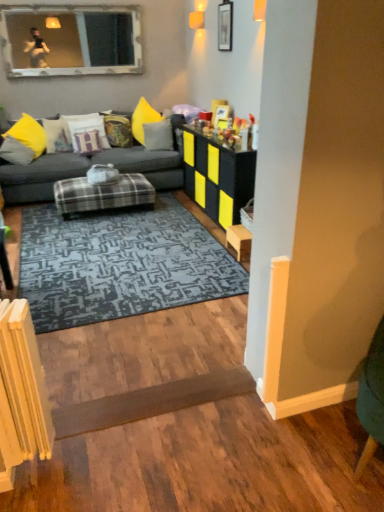
Where is `black textured cabinet at center, the 1th table in the right-to-left sequence`? black textured cabinet at center, the 1th table in the right-to-left sequence is located at coordinates (217, 177).

The width and height of the screenshot is (384, 512). I want to click on yellow fabric pillow at left, which ranks as the first pillow in left-to-right order, so click(x=16, y=151).

What do you see at coordinates (120, 264) in the screenshot? I see `blue textured rug at center` at bounding box center [120, 264].

Find the location of a particular element. The width and height of the screenshot is (384, 512). white fabric pillow at upper left, which is the 4th pillow in right-to-left order is located at coordinates (57, 135).

Measure the distance between point (106, 126) and camera.

A distance of 17.71 feet exists between point (106, 126) and camera.

Find the location of `dark brown wood plank at lower center`. dark brown wood plank at lower center is located at coordinates pos(151,401).

From the picture: Is there a large distance between white fabric pillow at upper left, which is the 4th pillow in right-to-left order, and plaid fabric ottoman at center, which is the 2th table from right to left?

Yes, white fabric pillow at upper left, which is the 4th pillow in right-to-left order, is far from plaid fabric ottoman at center, which is the 2th table from right to left.

Could you tell me if white fabric pillow at upper left, which is the 4th pillow in right-to-left order, is facing plaid fabric ottoman at center, which is the 2th table from right to left?

Yes.

Is point (56, 132) positioned behind point (137, 177)?

Yes, it is behind point (137, 177).

Does white fabric pillow at upper left, which is the 4th pillow in right-to-left order, have a smaller size compared to plaid fabric ottoman at center, which is the 2th table from right to left?

Correct, white fabric pillow at upper left, which is the 4th pillow in right-to-left order, occupies less space than plaid fabric ottoman at center, which is the 2th table from right to left.

Identify the location of studio couch above the black textured cabinet at center, the 1th table in the right-to-left sequence (from the image's perspective). Image resolution: width=384 pixels, height=512 pixels. point(86,170).

Is dark gray fabric couch at center looking in the opposite direction of black textured cabinet at center, the second table in the left-to-right sequence?

That's not correct — dark gray fabric couch at center is not looking away from black textured cabinet at center, the second table in the left-to-right sequence.

From the picture: In terms of height, does dark gray fabric couch at center look taller or shorter compared to black textured cabinet at center, the 1th table in the right-to-left sequence?

Considering their sizes, dark gray fabric couch at center has more height than black textured cabinet at center, the 1th table in the right-to-left sequence.

Is black textured cabinet at center, the 1th table in the right-to-left sequence, a part of dark gray fabric couch at center?

No, black textured cabinet at center, the 1th table in the right-to-left sequence, is not surrounded by dark gray fabric couch at center.

From a real-world perspective, is dark gray fabric couch at center on plaid fabric ottoman at center, which is the 2th table from right to left?

Yes, from a real-world perspective, dark gray fabric couch at center is above plaid fabric ottoman at center, which is the 2th table from right to left.

Between dark gray fabric couch at center and plaid fabric ottoman at center, which is the 2th table from right to left, which one has larger width?

dark gray fabric couch at center is wider.

Considering the relative sizes of dark gray fabric couch at center and plaid fabric ottoman at center, the first table when ordered from left to right, in the image provided, is dark gray fabric couch at center smaller than plaid fabric ottoman at center, the first table when ordered from left to right,?

No, dark gray fabric couch at center is not smaller than plaid fabric ottoman at center, the first table when ordered from left to right.

Between dark gray fabric couch at center and plaid fabric ottoman at center, the first table when ordered from left to right, which one appears on the right side from the viewer's perspective?

From the viewer's perspective, plaid fabric ottoman at center, the first table when ordered from left to right, appears more on the right side.

Can you confirm if black textured cabinet at center, the 1th table in the right-to-left sequence, is thinner than velvet yellow pillow at center, arranged as the 4th pillow when viewed from the left?

Incorrect, the width of black textured cabinet at center, the 1th table in the right-to-left sequence, is not less than that of velvet yellow pillow at center, arranged as the 4th pillow when viewed from the left.

Who is smaller, black textured cabinet at center, the 1th table in the right-to-left sequence, or velvet yellow pillow at center, positioned as the 2th pillow in right-to-left order?

Smaller between the two is velvet yellow pillow at center, positioned as the 2th pillow in right-to-left order.

Looking at this image, which is nearer, [220,218] or [121,142]?

Point [220,218] is positioned closer to the camera compared to point [121,142].

From a real-world perspective, is black textured cabinet at center, the 1th table in the right-to-left sequence, physically above velvet yellow pillow at center, arranged as the 4th pillow when viewed from the left?

Incorrect, from a real-world perspective, black textured cabinet at center, the 1th table in the right-to-left sequence, is lower than velvet yellow pillow at center, arranged as the 4th pillow when viewed from the left.

In the scene shown: Which object is closer to the camera, velvet yellow pillow at center, positioned as the 2th pillow in right-to-left order, or wooden picture frame at upper center?

Positioned in front is wooden picture frame at upper center.

Measure the distance from velvet yellow pillow at center, positioned as the 2th pillow in right-to-left order, to wooden picture frame at upper center.

velvet yellow pillow at center, positioned as the 2th pillow in right-to-left order, and wooden picture frame at upper center are 5.71 feet apart from each other.

From the image's perspective, which pillow is the 1st one below the wooden picture frame at upper center? Please provide its 2D coordinates.

[(118, 130)]

Identify the location of picture frame on the right side of dark brown wood plank at lower center. The width and height of the screenshot is (384, 512). (225, 25).

Is dark brown wood plank at lower center facing away from wooden picture frame at upper center?

No, dark brown wood plank at lower center is not facing away from wooden picture frame at upper center.

From the picture: Considering the positions of objects dark brown wood plank at lower center and wooden picture frame at upper center in the image provided, who is more to the right, dark brown wood plank at lower center or wooden picture frame at upper center?

wooden picture frame at upper center.

Which is correct: blue textured rug at center is inside wooden picture frame at upper center, or outside of it?

blue textured rug at center is outside wooden picture frame at upper center.

From a real-world perspective, is blue textured rug at center positioned above or below wooden picture frame at upper center?

In terms of real-world spatial position, blue textured rug at center is below wooden picture frame at upper center.

Measure the distance between blue textured rug at center and wooden picture frame at upper center.

They are 2.31 meters apart.

Is the surface of blue textured rug at center in direct contact with wooden picture frame at upper center?

No, blue textured rug at center is not with wooden picture frame at upper center.

What are the coordinates of `the 2nd table below when counting from the white fabric pillow at upper left, marked as the 2th pillow in a left-to-right arrangement (from the image's perspective)` in the screenshot? It's located at (102, 194).

Identify the location of studio couch that is behind the black textured cabinet at center, the second table in the left-to-right sequence. The image size is (384, 512). (86, 170).

From the image, which object appears to be farther from yellow fabric pillow at left, which ranks as the first pillow in left-to-right order, wooden stool at right or black textured cabinet at center, the second table in the left-to-right sequence?

wooden stool at right.

Based on their spatial positions, is dark gray fabric couch at center or wooden picture frame at upper center closer to wooden stool at right?

dark gray fabric couch at center is closer to wooden stool at right.

Looking at the image, which one is located further to yellow fabric pillow at left, the 5th pillow from the right, velvet purple pillow at center, placed as the third pillow when sorted from right to left, or gray textured pillow at center, which is counted as the fifth pillow, starting from the left?

The object further to yellow fabric pillow at left, the 5th pillow from the right, is gray textured pillow at center, which is counted as the fifth pillow, starting from the left.

Which object lies nearer to the anchor point blue textured rug at center, velvet yellow pillow at center, positioned as the 2th pillow in right-to-left order, or plaid fabric ottoman at center, the first table when ordered from left to right?

plaid fabric ottoman at center, the first table when ordered from left to right, is positioned closer to the anchor blue textured rug at center.

From the image, which object appears to be nearer to gray textured pillow at center, which is counted as the fifth pillow, starting from the left, wooden stool at right or black textured cabinet at center, the 1th table in the right-to-left sequence?

black textured cabinet at center, the 1th table in the right-to-left sequence, is positioned closer to the anchor gray textured pillow at center, which is counted as the fifth pillow, starting from the left.

Which object lies nearer to the anchor point wooden picture frame at upper center, black textured cabinet at center, the 1th table in the right-to-left sequence, or dark gray fabric couch at center?

The object closer to wooden picture frame at upper center is black textured cabinet at center, the 1th table in the right-to-left sequence.

In the scene shown: From the image, which object appears to be farther from plaid fabric ottoman at center, the first table when ordered from left to right, dark gray fabric couch at center or white fabric pillow at upper left, which is the 4th pillow in right-to-left order?

white fabric pillow at upper left, which is the 4th pillow in right-to-left order.

Based on their spatial positions, is plaid fabric ottoman at center, which is the 2th table from right to left, or white fabric pillow at upper left, marked as the 2th pillow in a left-to-right arrangement, closer to dark gray fabric couch at center?

plaid fabric ottoman at center, which is the 2th table from right to left.

This screenshot has width=384, height=512. Find the location of `studio couch located between blue textured rug at center and yellow fabric pillow at left, which ranks as the first pillow in left-to-right order, in the depth direction`. studio couch located between blue textured rug at center and yellow fabric pillow at left, which ranks as the first pillow in left-to-right order, in the depth direction is located at coordinates (86, 170).

At what (x,y) coordinates should I click in order to perform the action: click on stool between dark brown wood plank at lower center and yellow fabric pillow at left, which ranks as the first pillow in left-to-right order, in the front-back direction. Please return your answer as a coordinate pair (x, y). The width and height of the screenshot is (384, 512). Looking at the image, I should click on (239, 241).

You are a GUI agent. You are given a task and a screenshot of the screen. Output one action in this format:
    pyautogui.click(x=<x>, y=<y>)
    Task: Click on the stool between dark brown wood plank at lower center and velvet purple pillow at center, placed as the third pillow when sorted from right to left, from front to back
    This screenshot has width=384, height=512.
    Given the screenshot: What is the action you would take?
    pyautogui.click(x=239, y=241)

Where is `table located between yellow fabric pillow at left, which ranks as the first pillow in left-to-right order, and black textured cabinet at center, the 1th table in the right-to-left sequence, in the left-right direction`? Image resolution: width=384 pixels, height=512 pixels. table located between yellow fabric pillow at left, which ranks as the first pillow in left-to-right order, and black textured cabinet at center, the 1th table in the right-to-left sequence, in the left-right direction is located at coordinates [x=102, y=194].